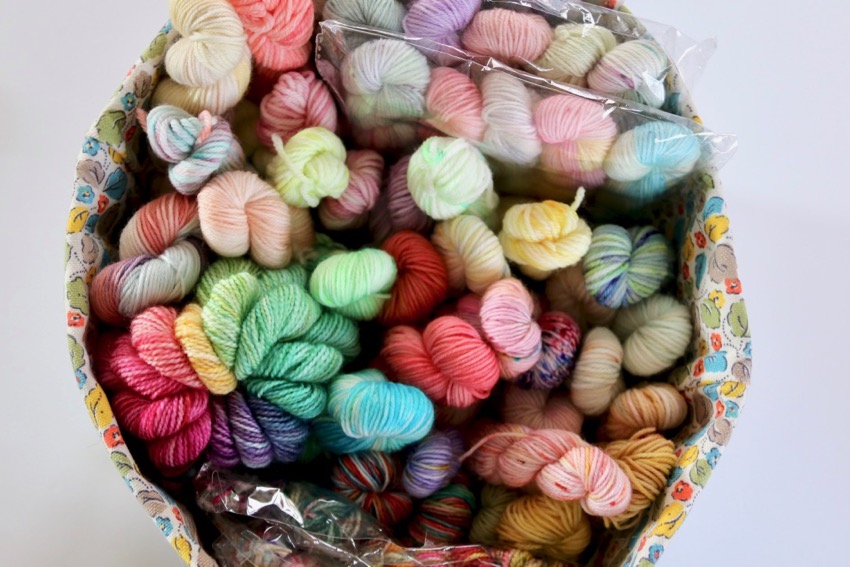
Find the location of `basket`. basket is located at coordinates (176, 527), (76, 312), (133, 84), (712, 214), (722, 346), (661, 518).